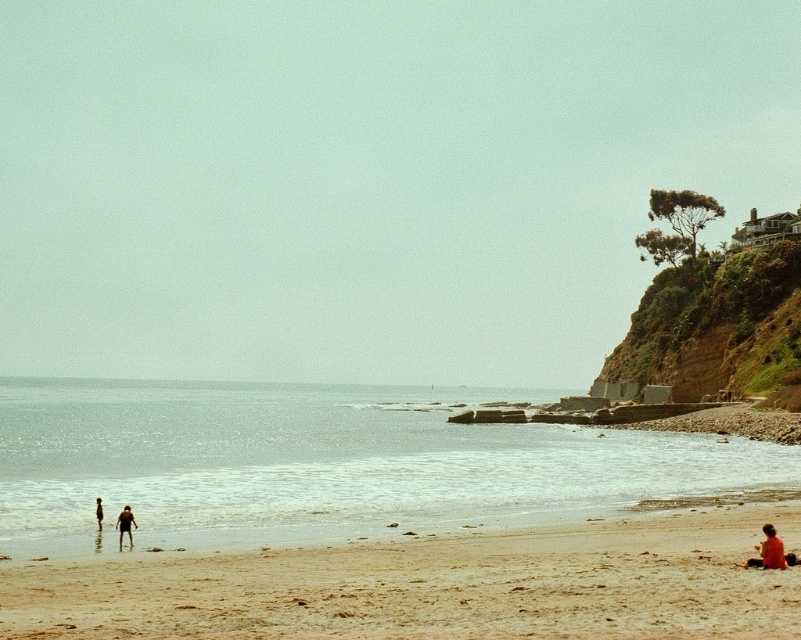
Does clear blue water at lower center have a smaller size compared to green mossy rock at upper right?

No, clear blue water at lower center is not smaller than green mossy rock at upper right.

Locate an element on the screen. The height and width of the screenshot is (640, 801). clear blue water at lower center is located at coordinates (329, 465).

What do you see at coordinates (329, 465) in the screenshot?
I see `clear blue water at lower center` at bounding box center [329, 465].

Locate an element on the screen. This screenshot has height=640, width=801. clear blue water at lower center is located at coordinates (329, 465).

Who is positioned more to the right, clear blue water at lower center or matte skin couple at lower left?

matte skin couple at lower left

Which of these two, clear blue water at lower center or matte skin couple at lower left, stands shorter?

matte skin couple at lower left

Which is behind, point (400, 442) or point (129, 532)?

The point (400, 442) is more distant.

Locate an element on the screen. This screenshot has width=801, height=640. clear blue water at lower center is located at coordinates [329, 465].

Is green mossy rock at upper right to the right of red fabric person at lower right from the viewer's perspective?

Correct, you'll find green mossy rock at upper right to the right of red fabric person at lower right.

The image size is (801, 640). What do you see at coordinates (718, 328) in the screenshot?
I see `green mossy rock at upper right` at bounding box center [718, 328].

Is point (651, 372) more distant than point (743, 564)?

That is True.

In order to click on green mossy rock at upper right in this screenshot , I will do `click(718, 328)`.